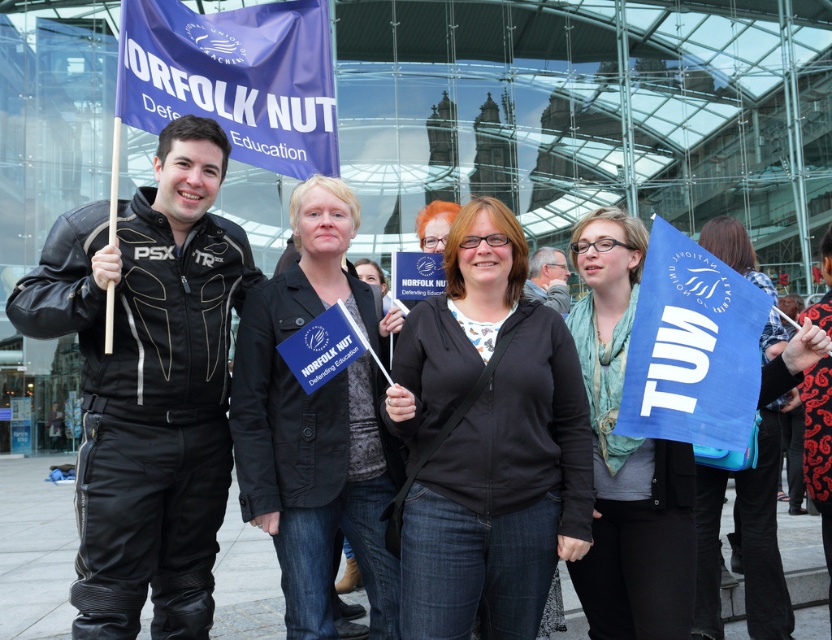
Question: Estimate the real-world distances between objects in this image. Which object is farther from the black fabric jacket at center?

Choices:
 (A) matte blue flag at center
 (B) black leather jacket at center
 (C) blue fabric scarf at center

Answer: (A)

Question: Which point is farther from the camera taking this photo?

Choices:
 (A) (593, 586)
 (B) (707, 240)

Answer: (B)

Question: Can you confirm if black fabric jacket at center is wider than blue fabric scarf at center?

Choices:
 (A) no
 (B) yes

Answer: (A)

Question: Is the position of black fabric jacket at center more distant than that of black leather jacket at center?

Choices:
 (A) no
 (B) yes

Answer: (A)

Question: Among these objects, which one is farthest from the camera?

Choices:
 (A) black fabric jacket at center
 (B) blue fabric scarf at center
 (C) black leather jacket at center
 (D) matte blue flag at center

Answer: (C)

Question: Is black leather jacket at center below blue fabric scarf at center?

Choices:
 (A) yes
 (B) no

Answer: (A)